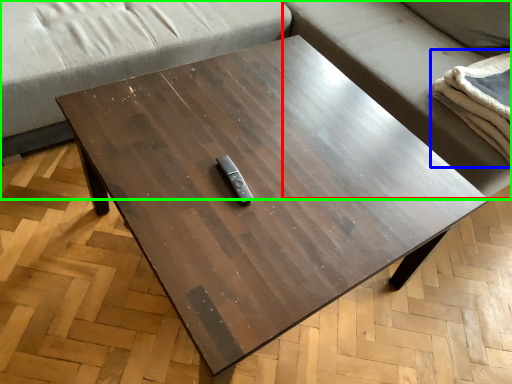
Question: Which object is the closest to the couch (highlighted by a red box)? Choose among these: blanket (highlighted by a blue box) or studio couch (highlighted by a green box).

Choices:
 (A) blanket
 (B) studio couch

Answer: (B)